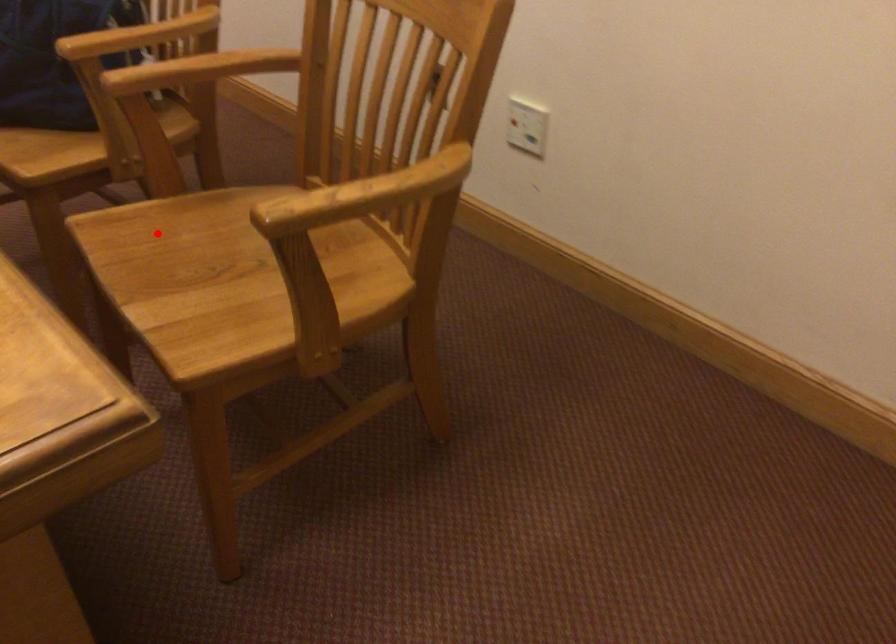
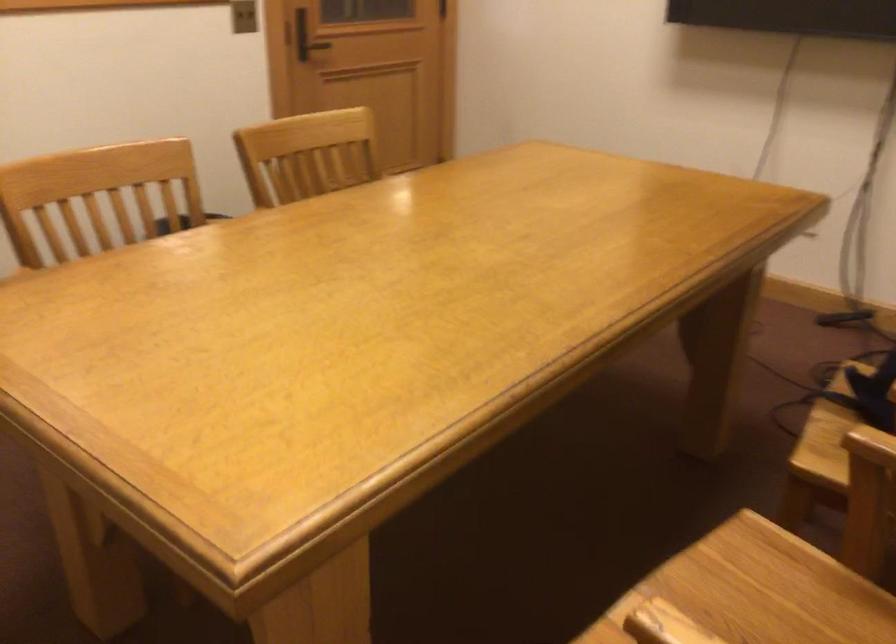
Question: I am providing you with two images of the same scene from different viewpoints. A red point is marked on the first image. At the location where the point appears in image 1, is it still visible in image 2?

Choices:
 (A) Yes
 (B) No

Answer: (A)